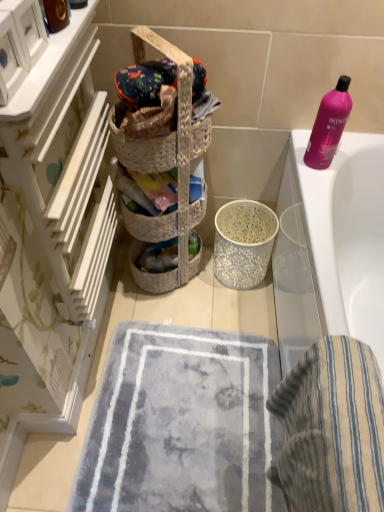
Find the location of a particular element. The width and height of the screenshot is (384, 512). vacant space in soft gray carpet at center (from a real-world perspective) is located at coordinates (174, 455).